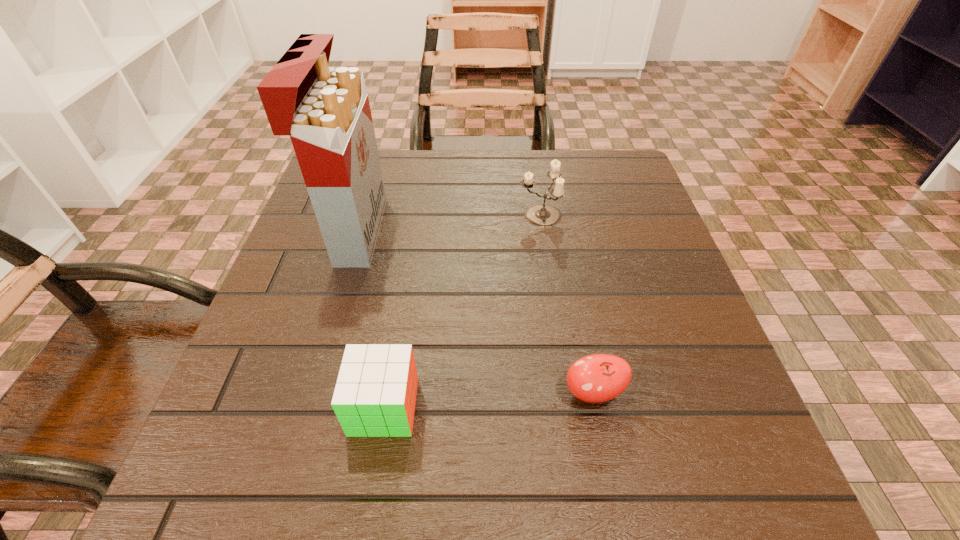
Image resolution: width=960 pixels, height=540 pixels. I want to click on vacant space that satisfies the following two spatial constraints: 1. with the lid open on the leftmost object; 2. on the left side of the cube, so point(303,407).